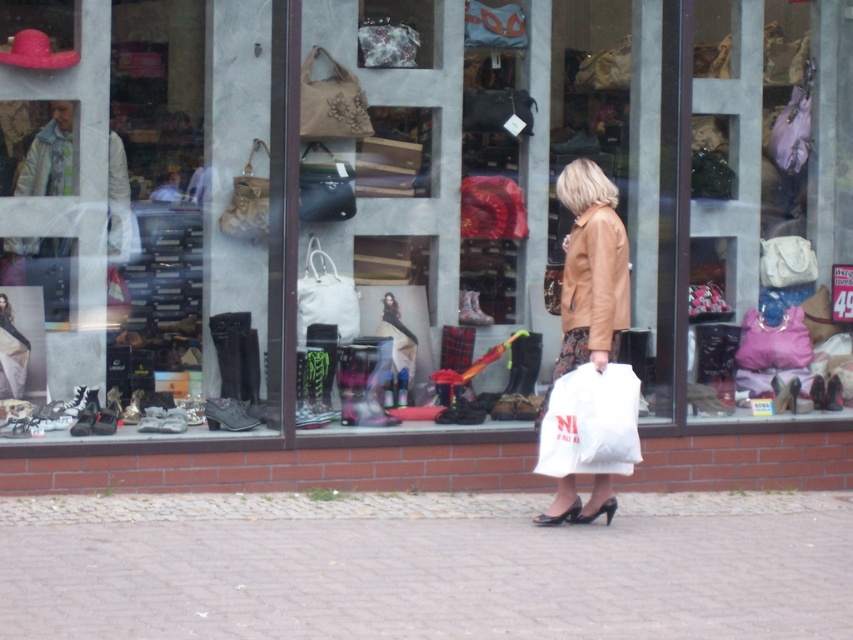
Is point (482, 524) positioned behind point (590, 340)?

That is True.

Does gray cobblestone pavement at lower center have a greater height compared to leather jacket at center?

No, gray cobblestone pavement at lower center is not taller than leather jacket at center.

Is point (625, 538) positioned after point (605, 282)?

Yes, point (625, 538) is farther from viewer.

This screenshot has height=640, width=853. In order to click on gray cobblestone pavement at lower center in this screenshot , I will do `click(422, 564)`.

Is matte brown leather jacket at center positioned at the back of matte black shoe at left?

No.

Measure the distance between point (590,304) and camera.

Point (590,304) and camera are 9.15 meters apart.

Between point (589, 282) and point (0, 314), which one is positioned behind?

Positioned behind is point (0, 314).

Image resolution: width=853 pixels, height=640 pixels. What are the coordinates of `matte brown leather jacket at center` in the screenshot? It's located at (590, 269).

Consider the image. Can you confirm if gray cobblestone pavement at lower center is thinner than matte brown leather jacket at center?

No.

Measure the distance between gray cobblestone pavement at lower center and camera.

7.43 meters

This screenshot has width=853, height=640. In order to click on gray cobblestone pavement at lower center in this screenshot , I will do `click(422, 564)`.